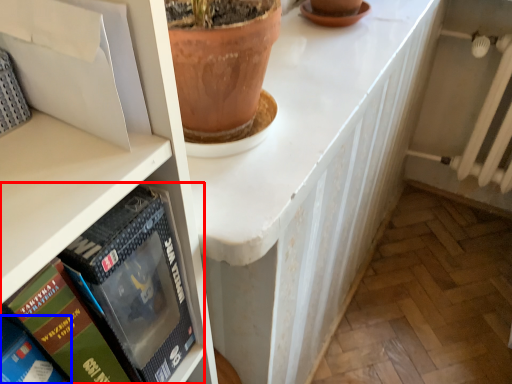
Question: Among these objects, which one is nearest to the camera, book (highlighted by a red box) or book (highlighted by a blue box)?

Choices:
 (A) book
 (B) book

Answer: (B)